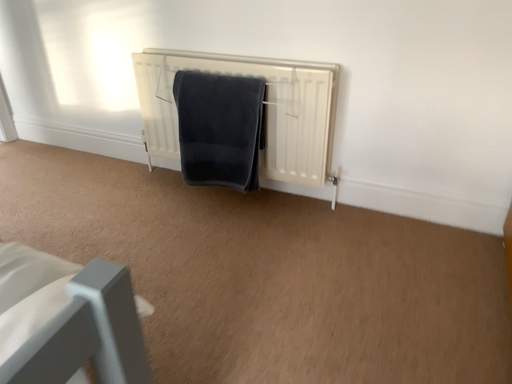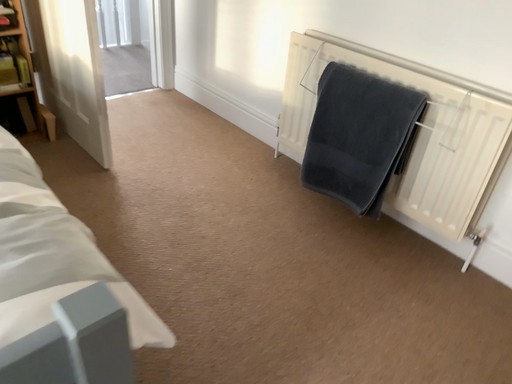
Question: Which way did the camera rotate in the video?

Choices:
 (A) rotated right
 (B) rotated left

Answer: (B)